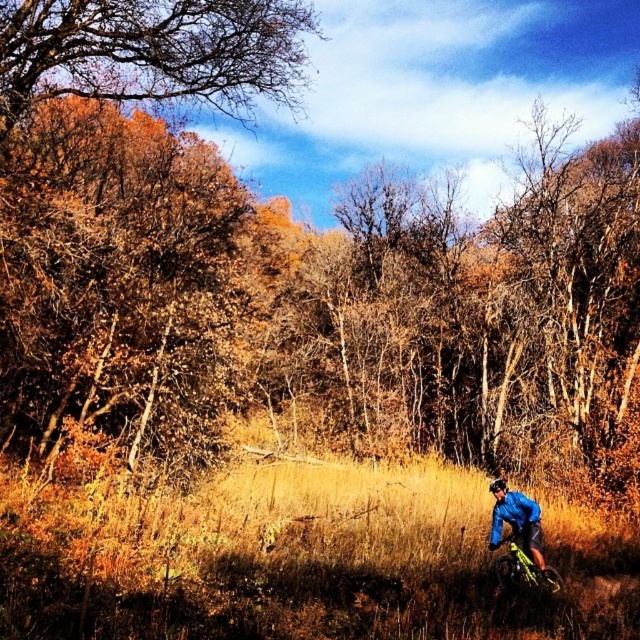
Can you confirm if matte blue jacket at lower right is smaller than yellow metallic bicycle at lower right?

No, matte blue jacket at lower right is not smaller than yellow metallic bicycle at lower right.

Does point (493, 570) come behind point (518, 586)?

That is True.

At what (x,y) coordinates should I click in order to perform the action: click on matte blue jacket at lower right. Please return your answer as a coordinate pair (x, y). Image resolution: width=640 pixels, height=640 pixels. Looking at the image, I should click on click(518, 540).